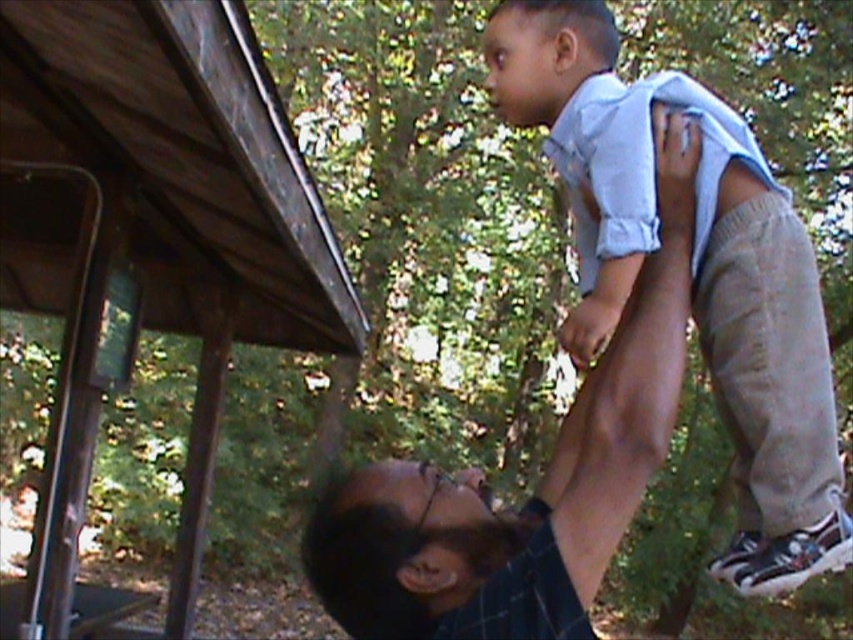
Which is above, light blue shirt at upper right or dark brown hair at upper center?

light blue shirt at upper right is higher up.

Does point (781, 369) come behind point (396, 636)?

Yes, point (781, 369) is behind point (396, 636).

Find the location of a particular element. This screenshot has width=853, height=640. light blue shirt at upper right is located at coordinates (692, 272).